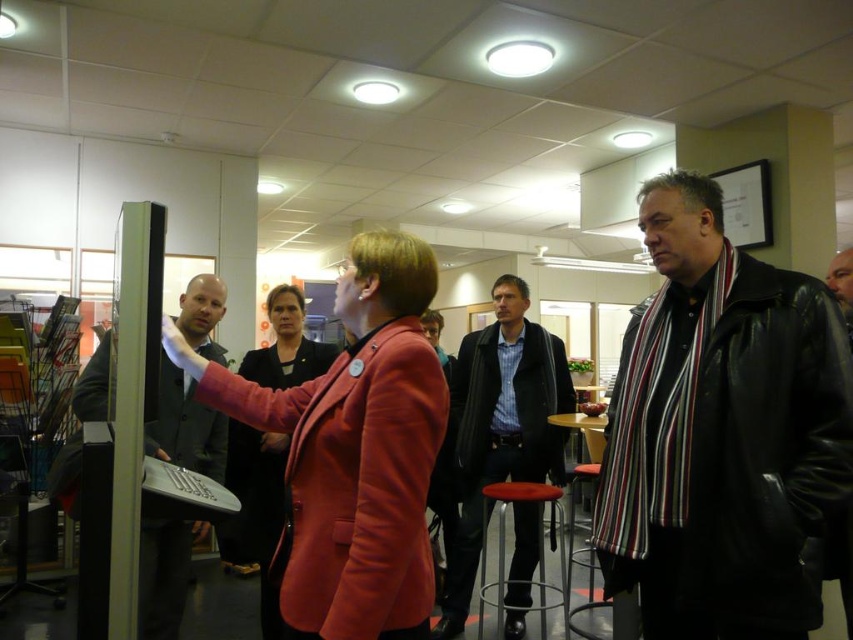
You are a photographer standing at the entrance of the room. You want to take a photo of the dark blue shirt at center. Where should you position yourself to capture the subject in the best possible frame?

→ The dark blue shirt at center is located at point 0.667 on the x axis and 0.587 on the y axis, so you should position yourself directly in front of that coordinate to ensure the subject is centered in your frame.

You are a photographer trying to capture a photo of the dark gray suit at left and the metallic silver bar stool at center. Which object should you focus on first if you want to ensure both are in clear focus?

The dark gray suit at left is much taller than the metallic silver bar stool at center, so you should focus on the dark gray suit at left first to ensure both are in clear focus.

You are a person standing in the room and want to sit down. You see the dark blue shirt at center and the metallic silver bar stool at center. Which object is closer to the floor?

The metallic silver bar stool at center is closer to the floor because the dark blue shirt at center is located above it.